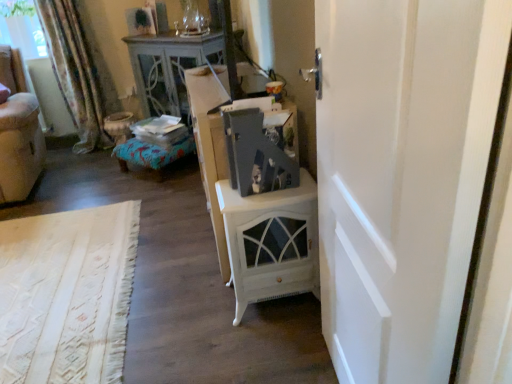
Question: Should I look upward or downward to see transparent glass window screen at upper left?

Choices:
 (A) up
 (B) down

Answer: (A)

Question: Does white glossy cabinet at center have a lesser height compared to floral fabric curtain at left?

Choices:
 (A) yes
 (B) no

Answer: (A)

Question: Is white glossy cabinet at center to the left of floral fabric curtain at left from the viewer's perspective?

Choices:
 (A) yes
 (B) no

Answer: (B)

Question: Would you consider white glossy cabinet at center to be distant from floral fabric curtain at left?

Choices:
 (A) no
 (B) yes

Answer: (B)

Question: Does white glossy cabinet at center have a greater width compared to floral fabric curtain at left?

Choices:
 (A) yes
 (B) no

Answer: (A)

Question: From the image's perspective, would you say white glossy cabinet at center is positioned over floral fabric curtain at left?

Choices:
 (A) no
 (B) yes

Answer: (A)

Question: From a real-world perspective, is white glossy cabinet at center on floral fabric curtain at left?

Choices:
 (A) no
 (B) yes

Answer: (A)

Question: Considering the relative sizes of velvet beige armchair at left and white matte door at right in the image provided, is velvet beige armchair at left shorter than white matte door at right?

Choices:
 (A) no
 (B) yes

Answer: (B)

Question: From a real-world perspective, is velvet beige armchair at left under white matte door at right?

Choices:
 (A) no
 (B) yes

Answer: (B)

Question: From the image's perspective, does velvet beige armchair at left appear lower than white matte door at right?

Choices:
 (A) yes
 (B) no

Answer: (B)

Question: Could you tell me if velvet beige armchair at left is facing white matte door at right?

Choices:
 (A) yes
 (B) no

Answer: (B)

Question: Are velvet beige armchair at left and white matte door at right located far from each other?

Choices:
 (A) yes
 (B) no

Answer: (A)

Question: Does velvet beige armchair at left have a smaller size compared to white matte door at right?

Choices:
 (A) no
 (B) yes

Answer: (A)

Question: Is velvet beige armchair at left a part of white painted wood nightstand at center?

Choices:
 (A) no
 (B) yes

Answer: (A)